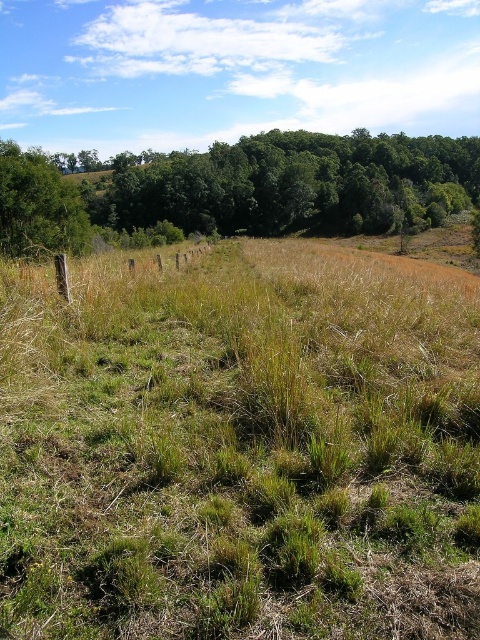
Question: Can you confirm if green leafy tree at upper center is positioned below green leafy tree at left?

Choices:
 (A) no
 (B) yes

Answer: (A)

Question: Which point appears farthest from the camera in this image?

Choices:
 (A) (336, 170)
 (B) (10, 220)

Answer: (A)

Question: Does green leafy tree at upper center come behind green leafy tree at left?

Choices:
 (A) no
 (B) yes

Answer: (B)

Question: Is green leafy tree at upper center below green leafy tree at left?

Choices:
 (A) no
 (B) yes

Answer: (A)

Question: Which object is farther from the camera taking this photo?

Choices:
 (A) green leafy tree at upper center
 (B) green leafy tree at left

Answer: (A)

Question: Among these objects, which one is farthest from the camera?

Choices:
 (A) green leafy tree at left
 (B) green leafy tree at upper center

Answer: (B)